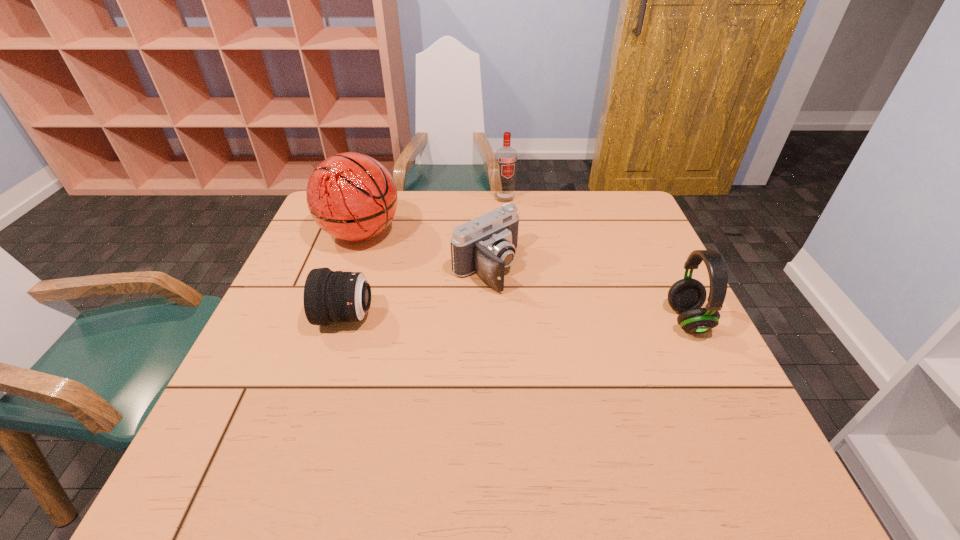
Find the location of a particular element. This screenshot has height=540, width=960. free space at the near right corner is located at coordinates (685, 408).

This screenshot has width=960, height=540. In order to click on free space between the rightmost object and the telephoto lens in this screenshot , I will do `click(516, 319)`.

You are a GUI agent. You are given a task and a screenshot of the screen. Output one action in this format:
    pyautogui.click(x=<x>, y=<y>)
    Task: Click on the vacant area that lies between the basketball and the farthest object
    
    Given the screenshot: What is the action you would take?
    pyautogui.click(x=433, y=215)

What are the coordinates of `vacant space in between the basketball and the farthest object` in the screenshot? It's located at (433, 215).

Identify the location of vacant point located between the basketball and the headset. (524, 276).

Identify the location of vacant point located between the basketball and the camera. Image resolution: width=960 pixels, height=540 pixels. coord(423,251).

Find the location of a particular element. Image resolution: width=960 pixels, height=540 pixels. free spot between the rightmost object and the camera is located at coordinates (587, 294).

Locate an element on the screen. The image size is (960, 540). vacant area that lies between the telephoto lens and the farthest object is located at coordinates (425, 258).

At what (x,y) coordinates should I click in order to perform the action: click on free spot between the vodka and the basketball. Please return your answer as a coordinate pair (x, y). The width and height of the screenshot is (960, 540). Looking at the image, I should click on (433, 215).

I want to click on free space between the basketball and the headset, so click(x=524, y=276).